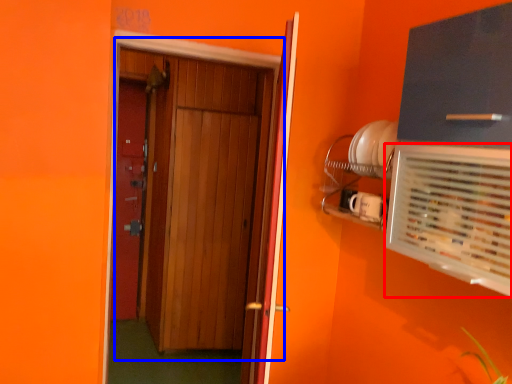
Question: Among these objects, which one is farthest to the camera, air conditioning (highlighted by a red box) or door (highlighted by a blue box)?

Choices:
 (A) air conditioning
 (B) door

Answer: (B)